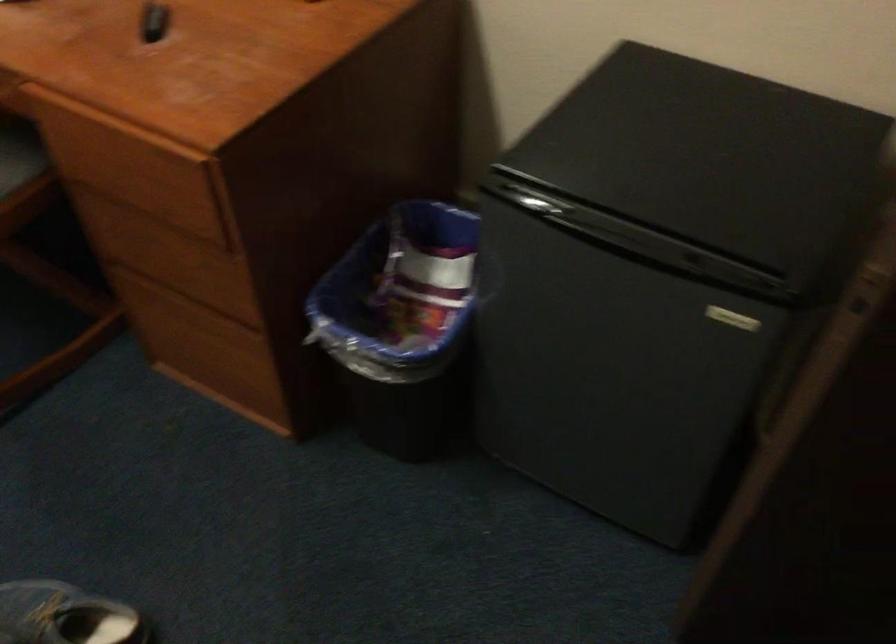
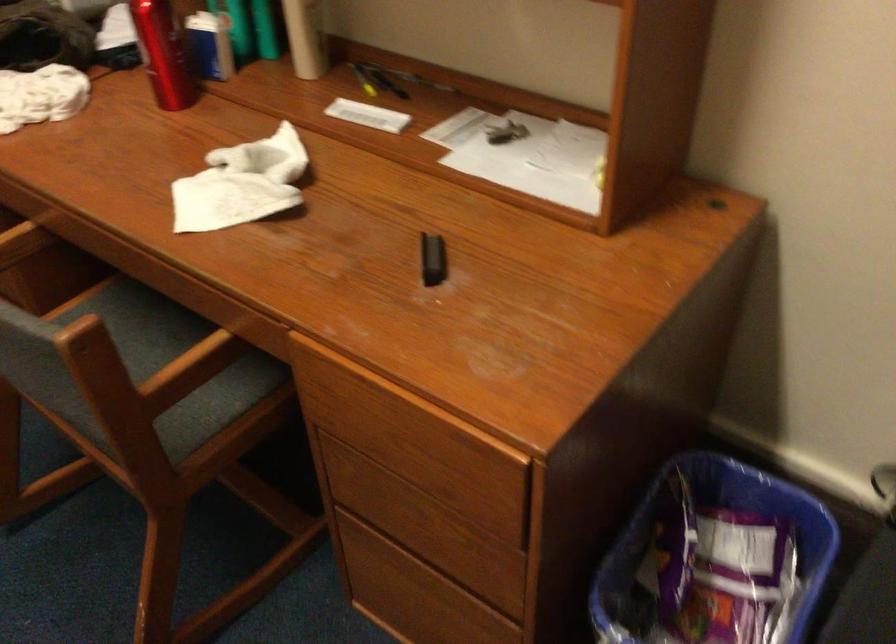
The point at (432, 277) is marked in the first image. Where is the corresponding point in the second image?

(711, 542)